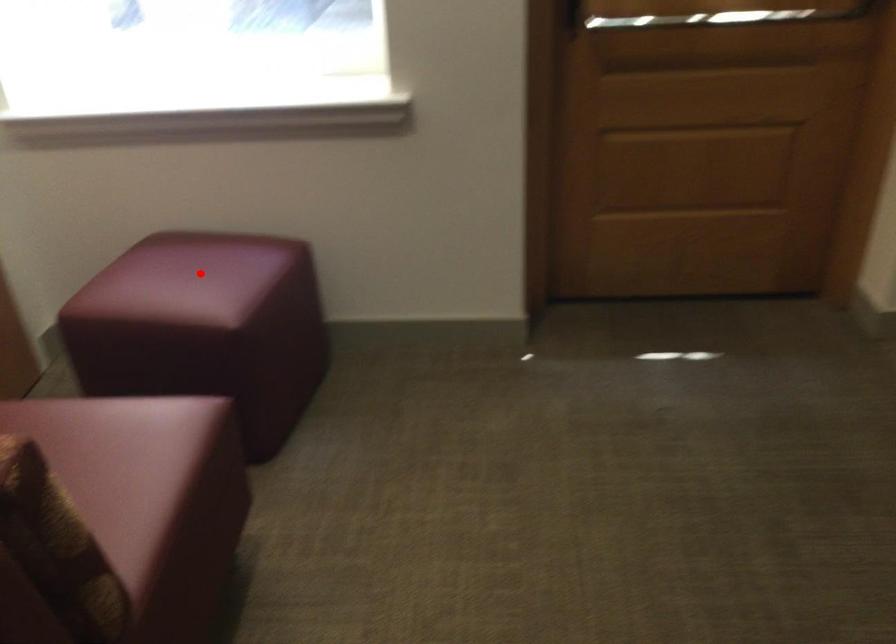
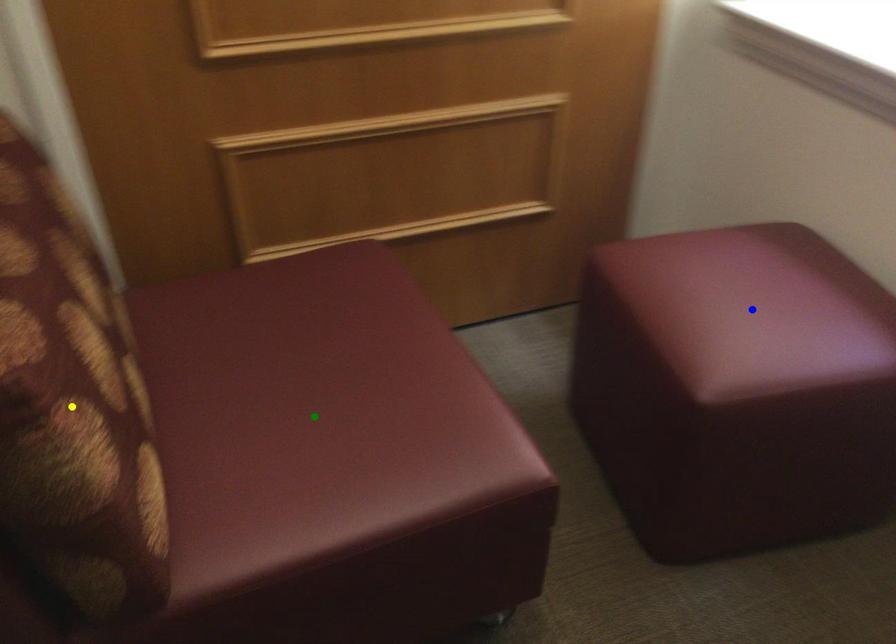
Question: I am providing you with two images of the same scene from different viewpoints. A red point is marked on the first image. You are given multiple points on the second image. In image 2, which mark is for the same physical point as the one in image 1?

Choices:
 (A) green point
 (B) yellow point
 (C) blue point

Answer: (C)